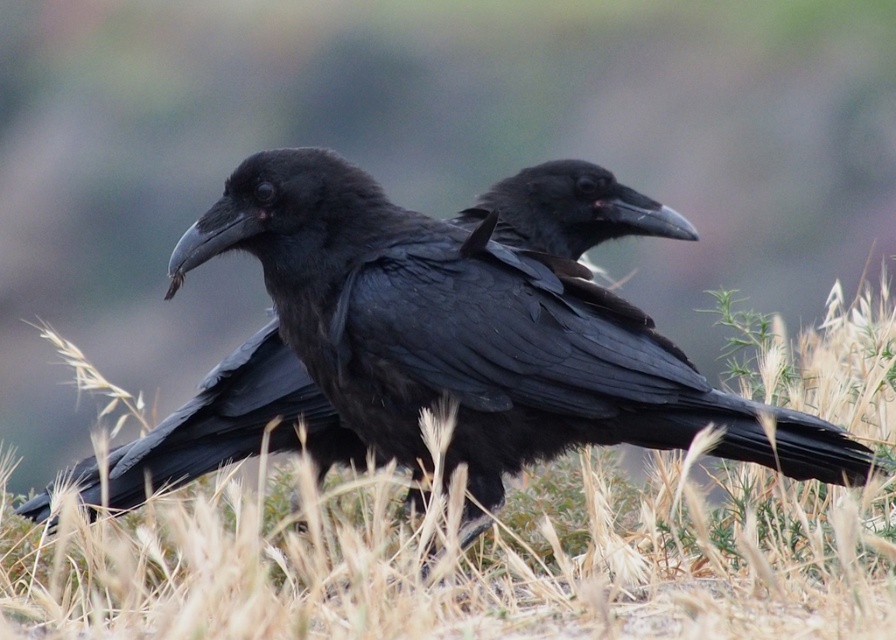
You are a photographer who wants to capture the shiny black raven at center clearly while keeping the dry grass at center in the frame. Which part of the image should you focus on to ensure the raven is sharp?

You should focus on the shiny black raven at center because it is smaller than the dry grass at center, so focusing on the smaller object will ensure it appears sharp while the background remains blurred.

You are a photographer trying to capture the two black birds on the dry grass at center. To ensure the birds are in focus, where should you aim the camera focus point?

The dry grass at center is located at point (467, 560), so you should aim the camera focus point at that coordinate to ensure the birds are in focus.